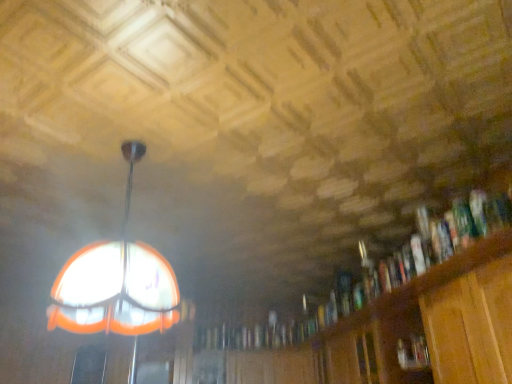
Question: From a real-world perspective, is wooden cabinet at lower right over hardcover book at right?

Choices:
 (A) yes
 (B) no

Answer: (A)

Question: From the image's perspective, is wooden cabinet at lower right below hardcover book at right?

Choices:
 (A) no
 (B) yes

Answer: (B)

Question: Is wooden cabinet at lower right wider than hardcover book at right?

Choices:
 (A) yes
 (B) no

Answer: (A)

Question: From the image's perspective, is wooden cabinet at lower right on hardcover book at right?

Choices:
 (A) no
 (B) yes

Answer: (A)

Question: Is wooden cabinet at lower right at the left side of hardcover book at right?

Choices:
 (A) no
 (B) yes

Answer: (B)

Question: Would you say wooden bookcase at right is to the left or to the right of hardcover book at right in the picture?

Choices:
 (A) left
 (B) right

Answer: (A)

Question: From the image's perspective, is wooden bookcase at right above or below hardcover book at right?

Choices:
 (A) above
 (B) below

Answer: (B)

Question: Looking at their shapes, would you say wooden bookcase at right is wider or thinner than hardcover book at right?

Choices:
 (A) wide
 (B) thin

Answer: (A)

Question: From a real-world perspective, is wooden bookcase at right physically located above or below hardcover book at right?

Choices:
 (A) below
 (B) above

Answer: (B)

Question: In terms of height, does hardcover book at right look taller or shorter compared to translucent glass dome at upper left?

Choices:
 (A) short
 (B) tall

Answer: (A)

Question: Is hardcover book at right to the left or to the right of translucent glass dome at upper left in the image?

Choices:
 (A) left
 (B) right

Answer: (B)

Question: In terms of size, does hardcover book at right appear bigger or smaller than translucent glass dome at upper left?

Choices:
 (A) big
 (B) small

Answer: (B)

Question: From a real-world perspective, is hardcover book at right positioned above or below translucent glass dome at upper left?

Choices:
 (A) below
 (B) above

Answer: (A)

Question: From a real-world perspective, is wooden cabinet at lower right positioned above or below translucent glass dome at upper left?

Choices:
 (A) above
 (B) below

Answer: (B)

Question: In terms of height, does wooden cabinet at lower right look taller or shorter compared to translucent glass dome at upper left?

Choices:
 (A) short
 (B) tall

Answer: (A)